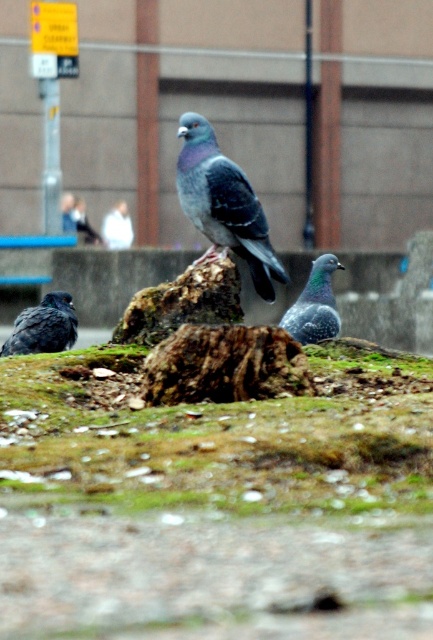
Is mossy rock at center to the right of matte gray pigeon at lower left from the viewer's perspective?

Yes, mossy rock at center is to the right of matte gray pigeon at lower left.

What do you see at coordinates (181, 304) in the screenshot? The height and width of the screenshot is (640, 433). I see `mossy rock at center` at bounding box center [181, 304].

Who is more forward, (x=226, y=316) or (x=45, y=310)?

Point (x=226, y=316) is in front.

The image size is (433, 640). Identify the location of mossy rock at center. (181, 304).

Is blue-gray feathered pigeon at center shorter than matte gray pigeon at lower left?

No, blue-gray feathered pigeon at center is not shorter than matte gray pigeon at lower left.

Looking at this image, does blue-gray feathered pigeon at center have a smaller size compared to matte gray pigeon at lower left?

No, blue-gray feathered pigeon at center is not smaller than matte gray pigeon at lower left.

At what (x,y) coordinates should I click in order to perform the action: click on blue-gray feathered pigeon at center. Please return your answer as a coordinate pair (x, y). The image size is (433, 640). Looking at the image, I should click on (223, 204).

Locate an element on the screen. This screenshot has width=433, height=640. blue-gray feathered pigeon at center is located at coordinates (223, 204).

Does point (293, 438) come farther from viewer compared to point (162, 308)?

No, (293, 438) is in front of (162, 308).

Who is higher up, green mossy ground at center or mossy rock at center?

Positioned higher is mossy rock at center.

Where is `green mossy ground at center`? green mossy ground at center is located at coordinates point(220,436).

I want to click on green mossy ground at center, so click(220, 436).